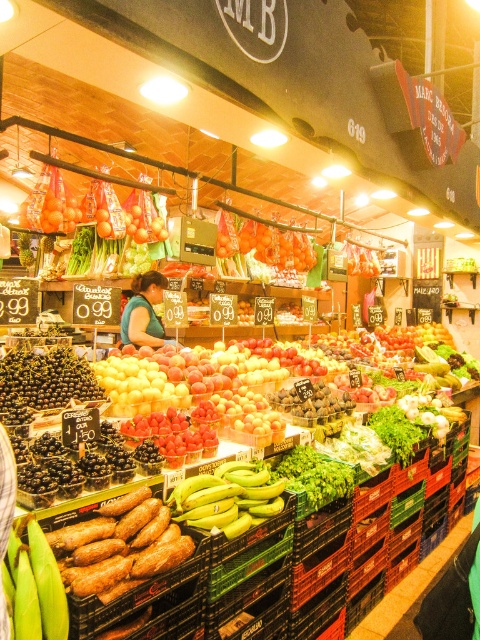
Is shiny red tomato at upper left to the left of shiny red tomatoes at center from the viewer's perspective?

Indeed, shiny red tomato at upper left is positioned on the left side of shiny red tomatoes at center.

Which is above, shiny red tomato at upper left or shiny red tomatoes at center?

shiny red tomato at upper left is above.

At what (x,y) coordinates should I click in order to perform the action: click on shiny red tomato at upper left. Please return your answer as a coordinate pair (x, y). This screenshot has width=480, height=640. Looking at the image, I should click on (120, 214).

Which is more to the left, shiny red tomatoes at center or green fabric shirt at center?

green fabric shirt at center

The image size is (480, 640). In order to click on shiny red tomatoes at center in this screenshot , I will do `click(276, 244)`.

At what (x,y) coordinates should I click in order to perform the action: click on shiny red tomatoes at center. Please return your answer as a coordinate pair (x, y). Looking at the image, I should click on (276, 244).

Describe the element at coordinates (228, 497) in the screenshot. I see `green matte bananas at center` at that location.

Does green matte bananas at center have a lesser height compared to shiny red tomatoes at center?

Yes.

Does point (259, 480) come in front of point (253, 225)?

Yes, it is in front of point (253, 225).

This screenshot has width=480, height=640. I want to click on green matte bananas at center, so click(x=228, y=497).